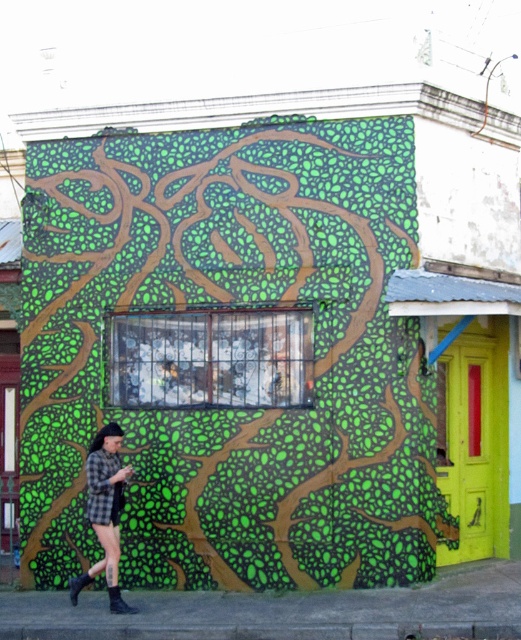
You are standing in front of the building with the mural. The green textured wall at center has coordinates at point 0.556, 0.441. If you want to take a photo of this wall, where should you position yourself relative to the building?

The green textured wall at center is located at point (229, 355), so you should position yourself directly in front of the building at the central area to capture the green textured wall at center in your photo.

You are a painter standing at the lower left corner of the building, near the checkered fabric shorts at lower left. You want to paint the green textured wall at center. Can you reach it without moving your ladder, considering your ladder is 1.5 meters long?

The green textured wall at center is 1.38 meters from the checkered fabric shorts at lower left. Since your ladder is 1.5 meters long, you can reach it without moving your ladder.

You are standing in the urban scene and want to place a small potted plant on the checkered fabric shorts at lower left. However, you need to ensure it won not block the view of the green textured wall at center. Is the location suitable?

The green textured wall at center is above the checkered fabric shorts at lower left, so placing the potted plant on the checkered fabric shorts at lower left would not block the view of the green textured wall at center since it is positioned below it.